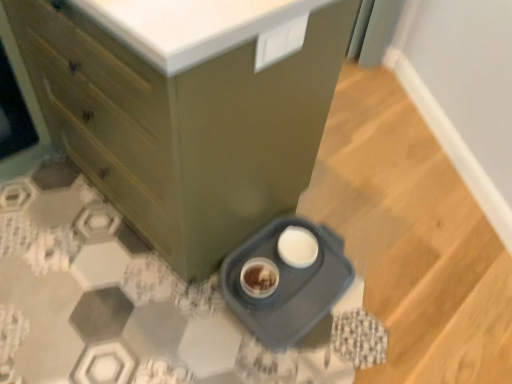
Question: Is gray plastic tray at lower center shorter than matte green cabinet at lower left?

Choices:
 (A) no
 (B) yes

Answer: (B)

Question: Is gray plastic tray at lower center smaller than matte green cabinet at lower left?

Choices:
 (A) no
 (B) yes

Answer: (B)

Question: Is gray plastic tray at lower center thinner than matte green cabinet at lower left?

Choices:
 (A) no
 (B) yes

Answer: (B)

Question: Considering the relative sizes of gray plastic tray at lower center and matte green cabinet at lower left in the image provided, is gray plastic tray at lower center wider than matte green cabinet at lower left?

Choices:
 (A) no
 (B) yes

Answer: (A)

Question: From the image's perspective, is gray plastic tray at lower center over matte green cabinet at lower left?

Choices:
 (A) no
 (B) yes

Answer: (A)

Question: Is matte green cabinet at lower left at the back of gray plastic tray at lower center?

Choices:
 (A) no
 (B) yes

Answer: (B)

Question: From the image's perspective, is matte green cabinet at lower left above gray plastic tray at lower center?

Choices:
 (A) yes
 (B) no

Answer: (A)

Question: Is matte green cabinet at lower left beside gray plastic tray at lower center?

Choices:
 (A) yes
 (B) no

Answer: (B)

Question: Does matte green cabinet at lower left lie in front of gray plastic tray at lower center?

Choices:
 (A) no
 (B) yes

Answer: (B)

Question: From the image's perspective, does matte green cabinet at lower left appear lower than gray plastic tray at lower center?

Choices:
 (A) no
 (B) yes

Answer: (A)

Question: Is matte green cabinet at lower left completely or partially outside of gray plastic tray at lower center?

Choices:
 (A) yes
 (B) no

Answer: (A)

Question: Considering the relative sizes of matte green cabinet at lower left and gray plastic tray at lower center in the image provided, is matte green cabinet at lower left smaller than gray plastic tray at lower center?

Choices:
 (A) no
 (B) yes

Answer: (A)

Question: From the image's perspective, relative to gray plastic tray at lower center, is matte green cabinet at lower left above or below?

Choices:
 (A) below
 (B) above

Answer: (B)